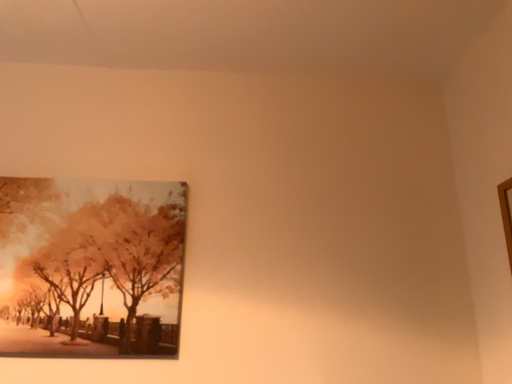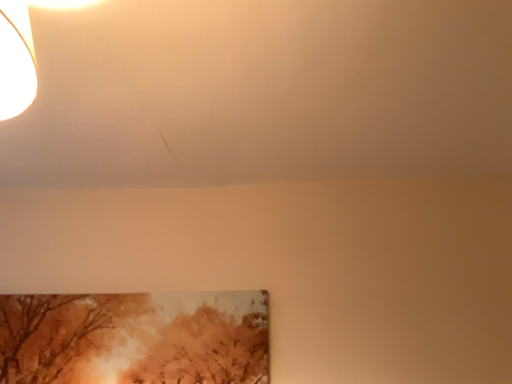
Question: Which way did the camera rotate in the video?

Choices:
 (A) rotated upward
 (B) rotated downward

Answer: (A)